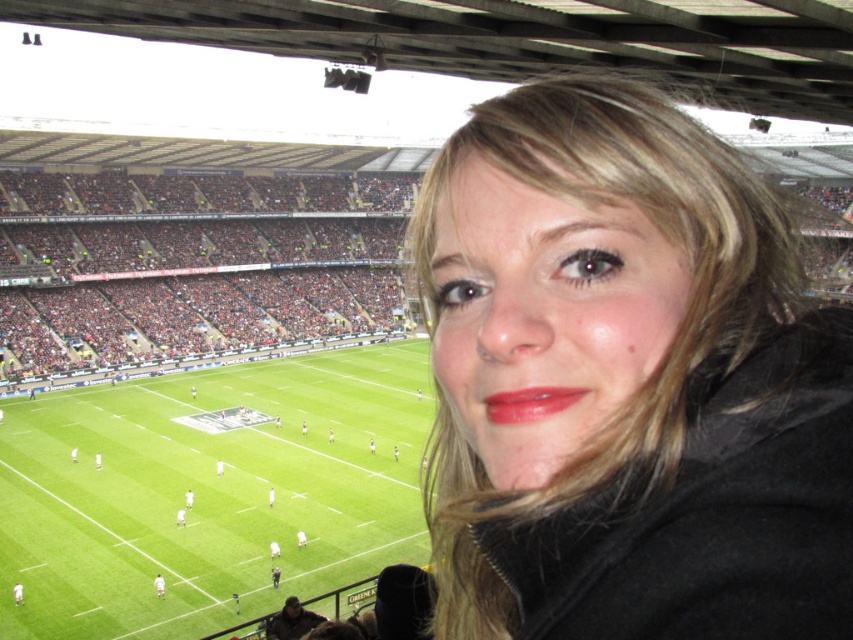
Question: Which object is farther from the camera taking this photo?

Choices:
 (A) black matte jacket at right
 (B) green grass football field at center
 (C) shiny red lipstick at center

Answer: (B)

Question: Which point is closer to the camera?

Choices:
 (A) black matte jacket at right
 (B) shiny red lipstick at center
 (C) green grass football field at center

Answer: (A)

Question: Estimate the real-world distances between objects in this image. Which object is farther from the black matte jacket at right?

Choices:
 (A) green grass football field at center
 (B) shiny red lipstick at center

Answer: (A)

Question: Considering the relative positions of black matte jacket at right and shiny red lipstick at center in the image provided, where is black matte jacket at right located with respect to shiny red lipstick at center?

Choices:
 (A) below
 (B) above

Answer: (A)

Question: Can you confirm if green grass football field at center is thinner than shiny red lipstick at center?

Choices:
 (A) yes
 (B) no

Answer: (B)

Question: Does green grass football field at center have a lesser width compared to shiny red lipstick at center?

Choices:
 (A) no
 (B) yes

Answer: (A)